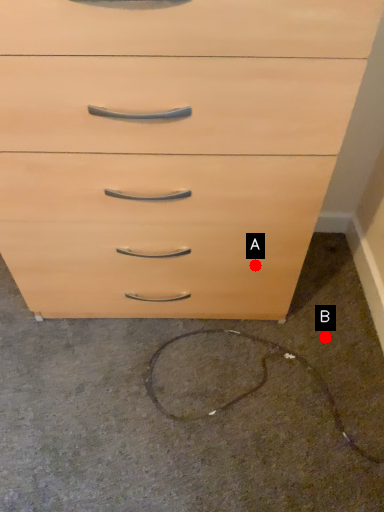
Question: Two points are circled on the image, labeled by A and B beside each circle. Which of the following is the farthest from the observer?

Choices:
 (A) A is further
 (B) B is further

Answer: (B)